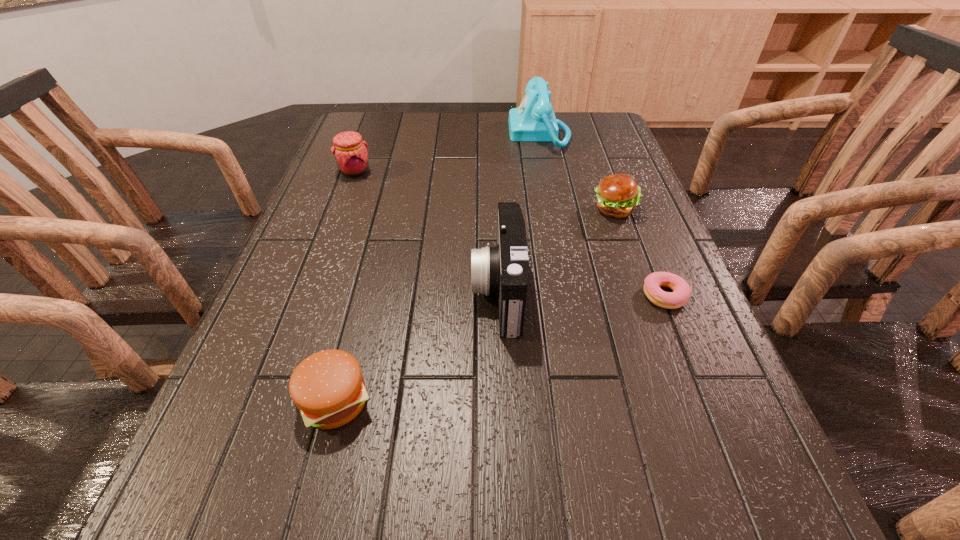
This screenshot has width=960, height=540. I want to click on vacant space in between the right hamburger and the left hamburger, so click(474, 305).

Where is `free space between the shortest object and the fourth object from right to left`? The width and height of the screenshot is (960, 540). free space between the shortest object and the fourth object from right to left is located at coordinates coord(582,294).

What are the coordinates of `vacant region between the shortest object and the fourth nearest object` in the screenshot? It's located at (639, 252).

Find the location of a particular element. The height and width of the screenshot is (540, 960). vacant region between the camcorder and the jam is located at coordinates point(426,232).

The image size is (960, 540). Find the location of `free space between the farthest object and the fifth nearest object`. free space between the farthest object and the fifth nearest object is located at coordinates (446, 152).

In order to click on empty location between the shortest object and the left hamburger in this screenshot , I will do `click(500, 348)`.

At what (x,y) coordinates should I click in order to perform the action: click on unoccupied position between the shortest object and the farther hamburger. Please return your answer as a coordinate pair (x, y). Looking at the image, I should click on (639, 252).

What are the coordinates of `vacant space in between the nearer hamburger and the jam` in the screenshot? It's located at (345, 286).

Identify the location of blank region between the right hamburger and the second farthest object. (485, 190).

Image resolution: width=960 pixels, height=540 pixels. Identify the location of free space between the jam and the nearer hamburger. (345, 286).